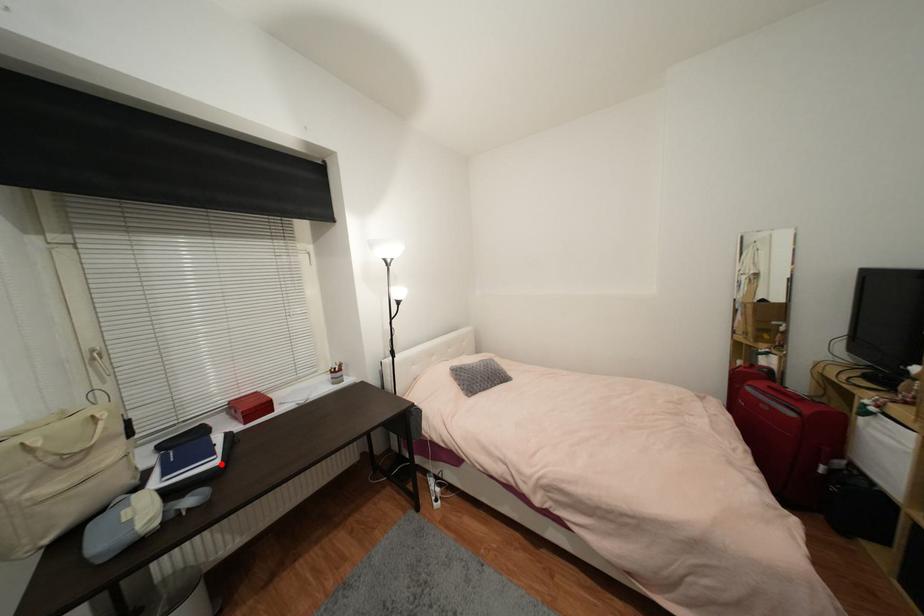
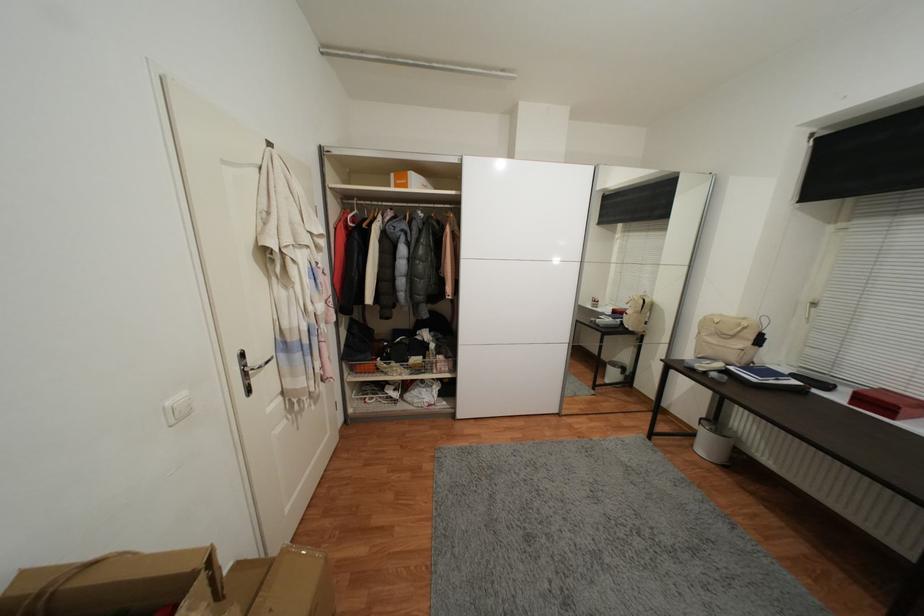
In the second image, find the point that corresponds to the highlighted location in the first image.

(759, 381)